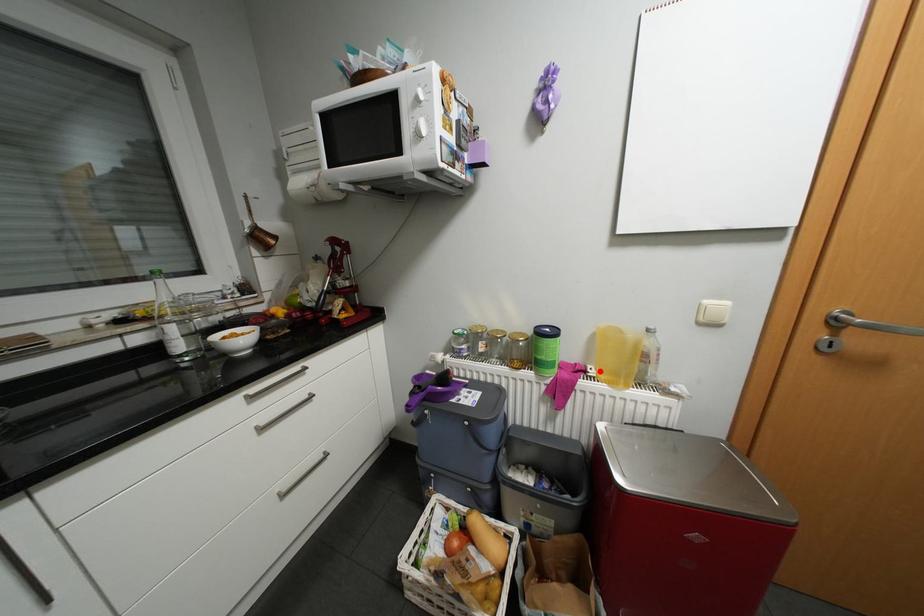
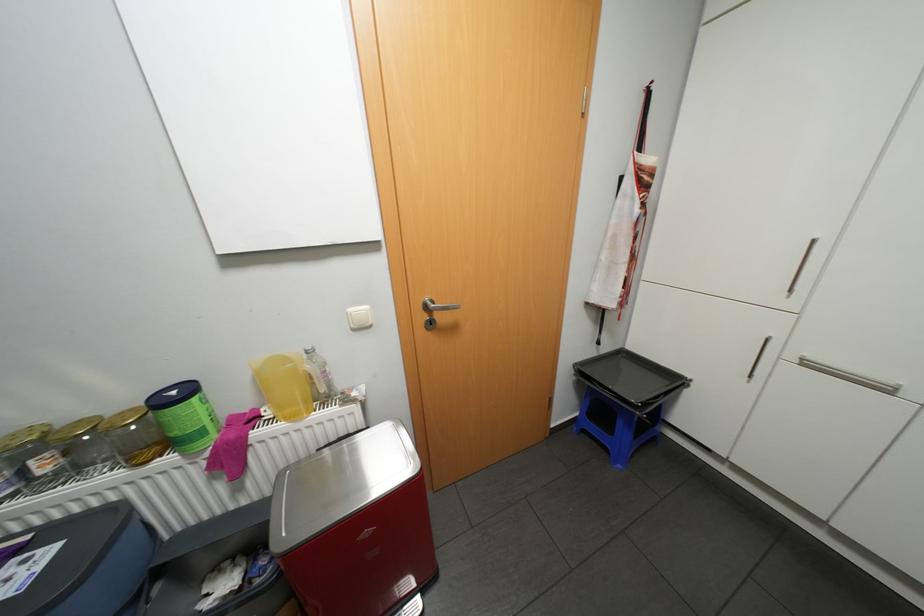
In the second image, find the point that corresponds to the highlighted location in the first image.

(275, 413)